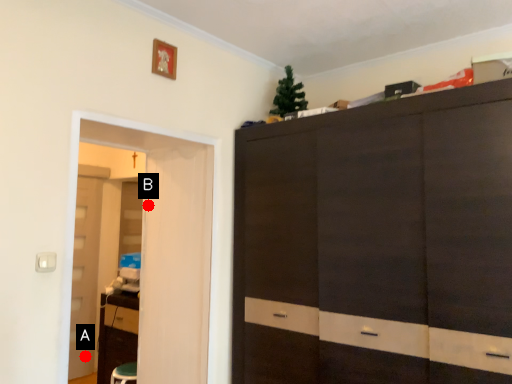
Question: Two points are circled on the image, labeled by A and B beside each circle. Among these points, which one is nearest to the camera?

Choices:
 (A) A is closer
 (B) B is closer

Answer: (B)